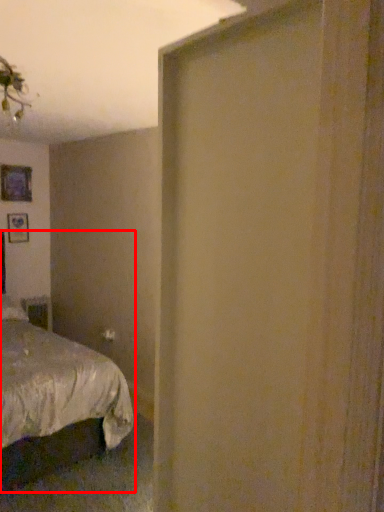
Question: From the image's perspective, what is the correct spatial relationship of bed (annotated by the red box) in relation to picture frame?

Choices:
 (A) above
 (B) below

Answer: (B)